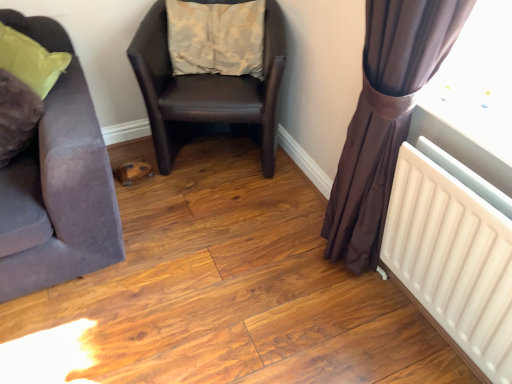
Question: Does beige fabric pillow at center lie in front of brown sheer curtain at right?

Choices:
 (A) yes
 (B) no

Answer: (B)

Question: Can you confirm if beige fabric pillow at center is positioned to the right of brown sheer curtain at right?

Choices:
 (A) yes
 (B) no

Answer: (B)

Question: Is beige fabric pillow at center oriented away from brown sheer curtain at right?

Choices:
 (A) no
 (B) yes

Answer: (A)

Question: Considering the relative sizes of beige fabric pillow at center and brown sheer curtain at right in the image provided, is beige fabric pillow at center shorter than brown sheer curtain at right?

Choices:
 (A) yes
 (B) no

Answer: (A)

Question: Does beige fabric pillow at center appear on the left side of brown sheer curtain at right?

Choices:
 (A) no
 (B) yes

Answer: (B)

Question: From a real-world perspective, is brown sheer curtain at right physically located above or below white plastic radiator at lower right?

Choices:
 (A) below
 (B) above

Answer: (B)

Question: Considering the positions of brown sheer curtain at right and white plastic radiator at lower right in the image, is brown sheer curtain at right wider or thinner than white plastic radiator at lower right?

Choices:
 (A) thin
 (B) wide

Answer: (B)

Question: Considering the positions of brown sheer curtain at right and white plastic radiator at lower right in the image, is brown sheer curtain at right bigger or smaller than white plastic radiator at lower right?

Choices:
 (A) big
 (B) small

Answer: (A)

Question: Do you think brown sheer curtain at right is within white plastic radiator at lower right, or outside of it?

Choices:
 (A) outside
 (B) inside

Answer: (A)

Question: Is point (182, 79) positioned closer to the camera than point (412, 51)?

Choices:
 (A) closer
 (B) farther

Answer: (B)

Question: Is brown leather chair at center, which ranks as the first chair in right-to-left order, spatially inside brown sheer curtain at right, or outside of it?

Choices:
 (A) inside
 (B) outside

Answer: (B)

Question: From a real-world perspective, is brown leather chair at center, which ranks as the first chair in right-to-left order, physically located above or below brown sheer curtain at right?

Choices:
 (A) above
 (B) below

Answer: (B)

Question: Visually, is brown leather chair at center, which ranks as the second chair in left-to-right order, positioned to the left or to the right of brown sheer curtain at right?

Choices:
 (A) right
 (B) left

Answer: (B)

Question: Is beige fabric pillow at center situated inside brown sheer curtain at right or outside?

Choices:
 (A) inside
 (B) outside

Answer: (B)

Question: In the image, is beige fabric pillow at center on the left side or the right side of brown sheer curtain at right?

Choices:
 (A) right
 (B) left

Answer: (B)